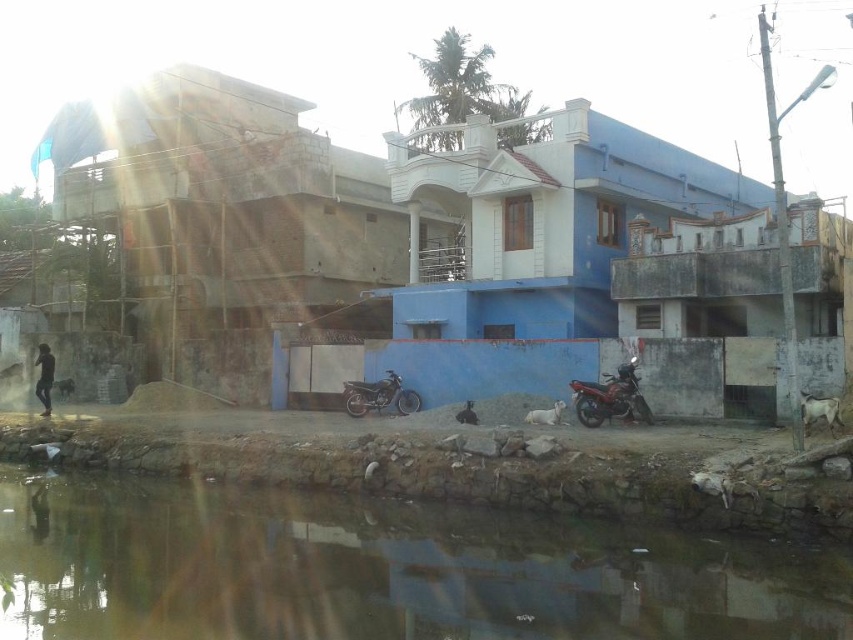
Question: Can you confirm if shiny red motorbike at lower right is bigger than shiny metallic motorbike at center?

Choices:
 (A) no
 (B) yes

Answer: (B)

Question: Is shiny red motorbike at lower right bigger than shiny metallic motorbike at center?

Choices:
 (A) yes
 (B) no

Answer: (A)

Question: Is the position of brown dirt river at lower center more distant than that of shiny metallic motorbike at center?

Choices:
 (A) no
 (B) yes

Answer: (A)

Question: Which of these objects is positioned closest to the brown dirt river at lower center?

Choices:
 (A) shiny metallic motorbike at center
 (B) shiny red motorbike at lower right

Answer: (B)

Question: Which point is farther to the camera?

Choices:
 (A) (642, 600)
 (B) (596, 403)

Answer: (B)

Question: Which object is farther from the camera taking this photo?

Choices:
 (A) brown dirt river at lower center
 (B) shiny metallic motorbike at center
 (C) shiny red motorbike at lower right

Answer: (B)